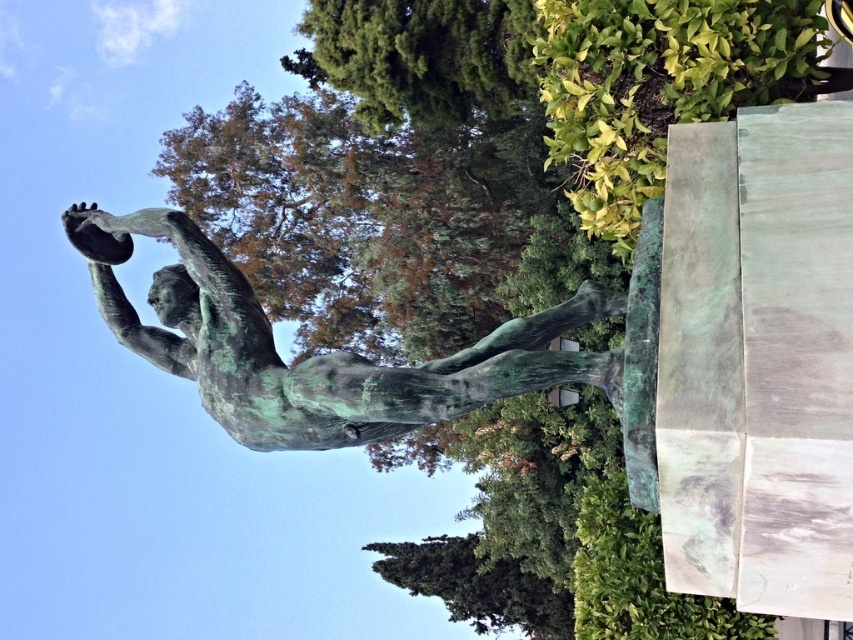
You are an art conservator examining the image. You need to determine which object occupies more visual space in the scene. Which is larger between the green patina statue at center and the green leafy bush at upper right?

The green patina statue at center is larger in size than the green leafy bush at upper right, so it occupies more visual space.

You are standing in front of the statue and want to take a photo of both the green leafy bush at upper right and the green verdigris statue at lower center. Which object should you focus on first to ensure both are in clear view?

You should focus on the green leafy bush at upper right first since it is closer to you than the green verdigris statue at lower center, ensuring both are in focus when using depth of field.

You are an artist sketching the statue and want to include the green leafy bush at upper right and the green textured tree at upper center in your drawing. Which of these two objects should you draw smaller to maintain the correct spatial relationship?

The green leafy bush at upper right should be drawn smaller because it occupies less space than the green textured tree at upper center.